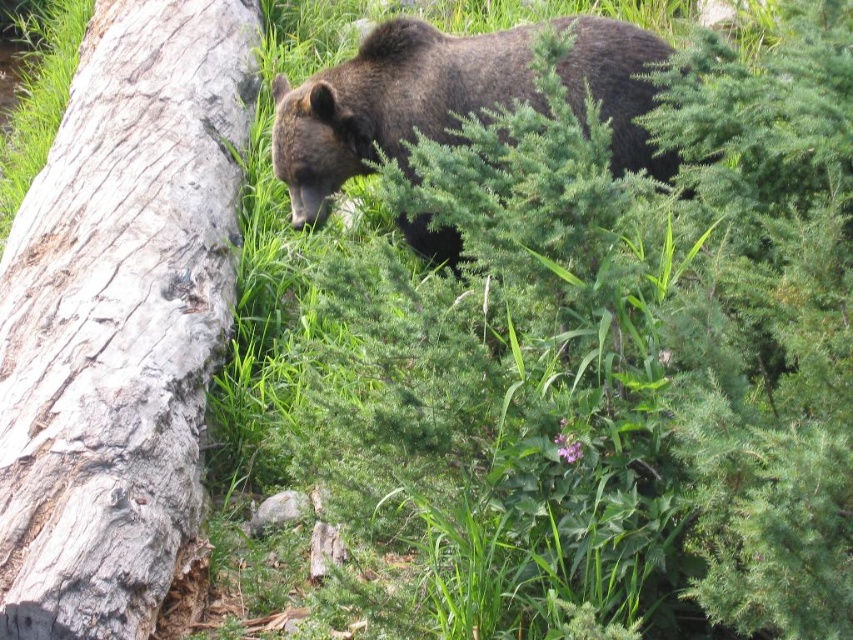
Can you confirm if gray rough bark tree trunk at left is bigger than dark brown fur bear at center?

Yes, gray rough bark tree trunk at left is bigger than dark brown fur bear at center.

From the picture: Does gray rough bark tree trunk at left lie behind dark brown fur bear at center?

No.

The image size is (853, 640). What do you see at coordinates (120, 317) in the screenshot?
I see `gray rough bark tree trunk at left` at bounding box center [120, 317].

What are the coordinates of `gray rough bark tree trunk at left` in the screenshot? It's located at (120, 317).